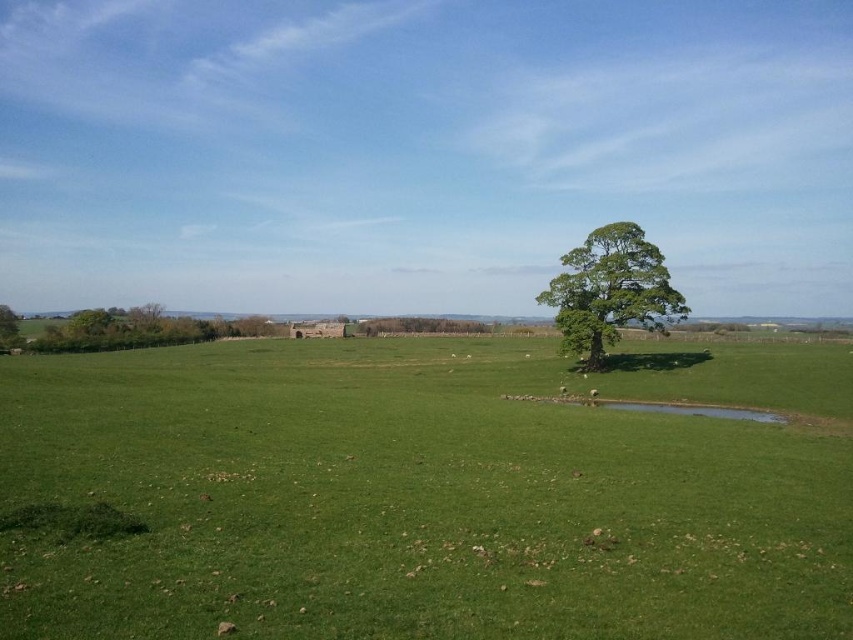
Which is above, green grassy field at center or green leafy tree at center?

Positioned higher is green leafy tree at center.

Is point (281, 577) closer to camera compared to point (669, 288)?

Yes.

This screenshot has height=640, width=853. What are the coordinates of `green grassy field at center` in the screenshot? It's located at (428, 492).

Can you confirm if green leafy tree at center is shorter than green leafy tree at left?

Result: In fact, green leafy tree at center may be taller than green leafy tree at left.

The height and width of the screenshot is (640, 853). Identify the location of green leafy tree at center. (610, 291).

Which is behind, point (625, 276) or point (7, 307)?

Point (7, 307)

This screenshot has width=853, height=640. I want to click on green leafy tree at center, so click(x=610, y=291).

Does green grassy field at center lie behind green leafy tree at left?

No.

In order to click on green grassy field at center in this screenshot , I will do 428,492.

The height and width of the screenshot is (640, 853). I want to click on green grassy field at center, so tap(428, 492).